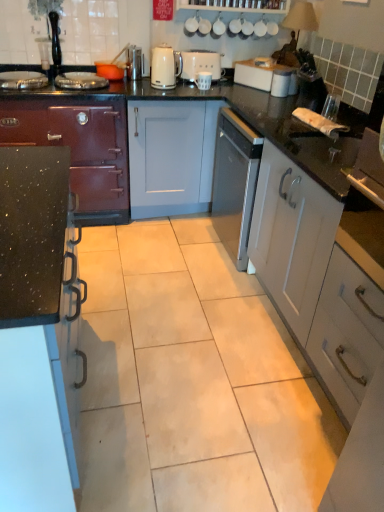
Question: Is matte black stove at left, the third cabinetry when ordered from right to left, wider than white matte mug at center, positioned as the 3th appliance in left-to-right order?

Choices:
 (A) yes
 (B) no

Answer: (A)

Question: Is matte black stove at left, the third cabinetry when ordered from right to left, far from white matte mug at center, positioned as the 3th appliance in left-to-right order?

Choices:
 (A) yes
 (B) no

Answer: (B)

Question: Is the position of matte black stove at left, the third cabinetry when ordered from right to left, more distant than that of white matte mug at center, which is counted as the 1th appliance, starting from the right?

Choices:
 (A) yes
 (B) no

Answer: (B)

Question: Considering the relative positions of matte black stove at left, which is counted as the first cabinetry, starting from the left, and white matte mug at center, positioned as the 3th appliance in left-to-right order, in the image provided, is matte black stove at left, which is counted as the first cabinetry, starting from the left, to the right of white matte mug at center, positioned as the 3th appliance in left-to-right order, from the viewer's perspective?

Choices:
 (A) yes
 (B) no

Answer: (B)

Question: From the image's perspective, is matte black stove at left, the third cabinetry when ordered from right to left, below white matte mug at center, which is counted as the 1th appliance, starting from the right?

Choices:
 (A) yes
 (B) no

Answer: (A)

Question: Considering the relative positions of matte black stove at left, which is counted as the first cabinetry, starting from the left, and white matte mug at center, positioned as the 3th appliance in left-to-right order, in the image provided, is matte black stove at left, which is counted as the first cabinetry, starting from the left, to the left of white matte mug at center, positioned as the 3th appliance in left-to-right order, from the viewer's perspective?

Choices:
 (A) no
 (B) yes

Answer: (B)

Question: Is the position of white matte mug at center, which is counted as the 1th appliance, starting from the right, less distant than that of white plastic toaster at upper center?

Choices:
 (A) yes
 (B) no

Answer: (A)

Question: Considering the relative positions of white matte mug at center, which is counted as the 1th appliance, starting from the right, and white plastic toaster at upper center in the image provided, is white matte mug at center, which is counted as the 1th appliance, starting from the right, behind white plastic toaster at upper center?

Choices:
 (A) no
 (B) yes

Answer: (A)

Question: Is there a large distance between white matte mug at center, positioned as the 3th appliance in left-to-right order, and white plastic toaster at upper center?

Choices:
 (A) yes
 (B) no

Answer: (B)

Question: Considering the relative sizes of white matte mug at center, which is counted as the 1th appliance, starting from the right, and white plastic toaster at upper center in the image provided, is white matte mug at center, which is counted as the 1th appliance, starting from the right, shorter than white plastic toaster at upper center?

Choices:
 (A) no
 (B) yes

Answer: (B)

Question: From the image's perspective, does white matte mug at center, which is counted as the 1th appliance, starting from the right, appear higher than white plastic toaster at upper center?

Choices:
 (A) no
 (B) yes

Answer: (A)

Question: Is white matte mug at center, which is counted as the 1th appliance, starting from the right, wider than white plastic toaster at upper center?

Choices:
 (A) no
 (B) yes

Answer: (A)

Question: From the image's perspective, is metallic silver toaster at upper center, which is counted as the 1th appliance, starting from the left, located above black speckled countertop at left, the 2th cabinetry viewed from the left?

Choices:
 (A) yes
 (B) no

Answer: (A)